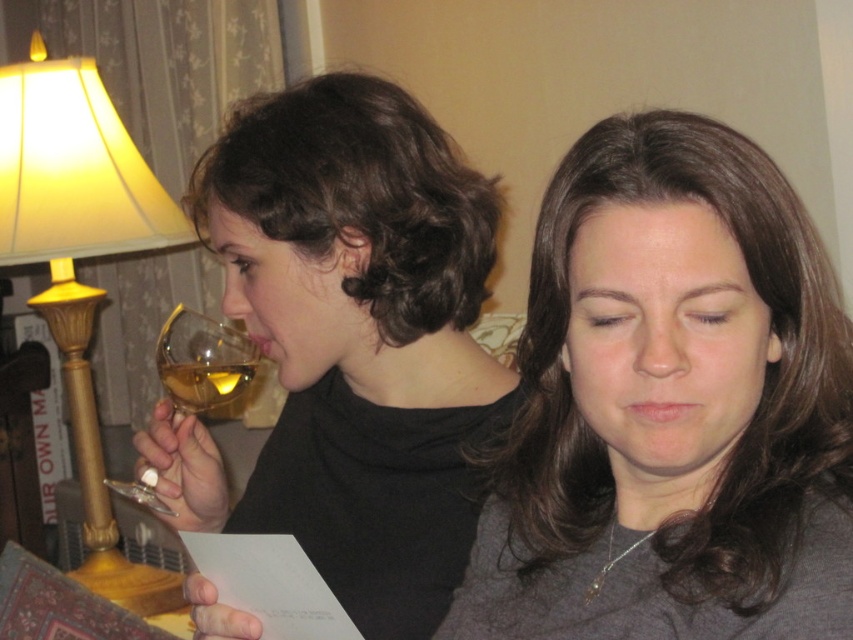
You are a photographer trying to capture the exact position of the point at coordinates point (x=202, y=362) in the image. According to the scene, where should you focus your camera?

The point (x=202, y=362) is on the translucent glass wine glass at left, so you should focus your camera on the translucent glass wine glass at left to capture that point.

You are a photographer setting up a shot of the scene. You want to ensure that the matte black wine glass at left and the translucent glass wine at upper left are both in focus. Since you need to know their positions relative to each other, can you tell me which one is positioned to the right of the other?

The matte black wine glass at left is positioned to the right of the translucent glass wine at upper left.